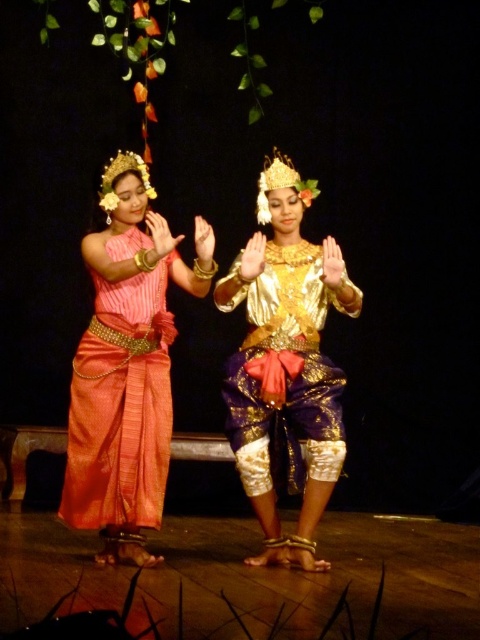
Between silk sari at center and gold shiny blouse at center, which one is positioned higher?

silk sari at center

Is silk sari at center to the right of gold shiny blouse at center from the viewer's perspective?

In fact, silk sari at center is to the left of gold shiny blouse at center.

Does point (149, 502) come behind point (257, 432)?

No, (149, 502) is in front of (257, 432).

Identify the location of silk sari at center. (127, 365).